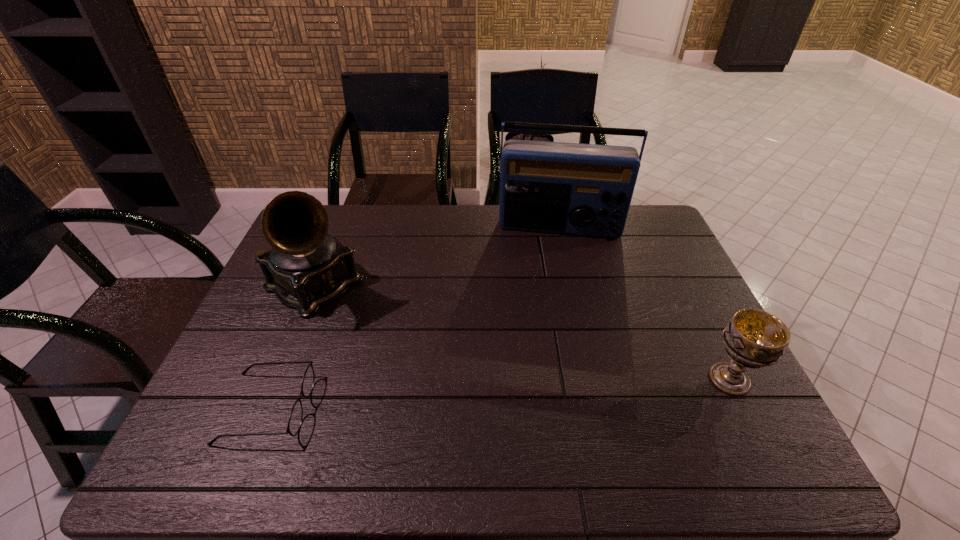
What are the coordinates of `object that ranks as the third closest to the second farthest object` in the screenshot? It's located at (753, 338).

Where is `free space that satisfies the following two spatial constraints: 1. on the front side of the shortest object; 2. on the front-facing side of the second farthest object`? This screenshot has width=960, height=540. free space that satisfies the following two spatial constraints: 1. on the front side of the shortest object; 2. on the front-facing side of the second farthest object is located at coordinates (264, 408).

Where is `blank area in the image that satisfies the following two spatial constraints: 1. on the front side of the phonograph record; 2. on the left side of the rightmost object`? This screenshot has height=540, width=960. blank area in the image that satisfies the following two spatial constraints: 1. on the front side of the phonograph record; 2. on the left side of the rightmost object is located at coordinates (276, 379).

At what (x,y) coordinates should I click in order to perform the action: click on free region that satisfies the following two spatial constraints: 1. on the front side of the second farthest object; 2. on the right side of the third tallest object. Please return your answer as a coordinate pair (x, y). Looking at the image, I should click on (276, 379).

Where is `vacant space that satisfies the following two spatial constraints: 1. on the front side of the third object from left to right; 2. on the left side of the rightmost object`? The width and height of the screenshot is (960, 540). vacant space that satisfies the following two spatial constraints: 1. on the front side of the third object from left to right; 2. on the left side of the rightmost object is located at coordinates (594, 379).